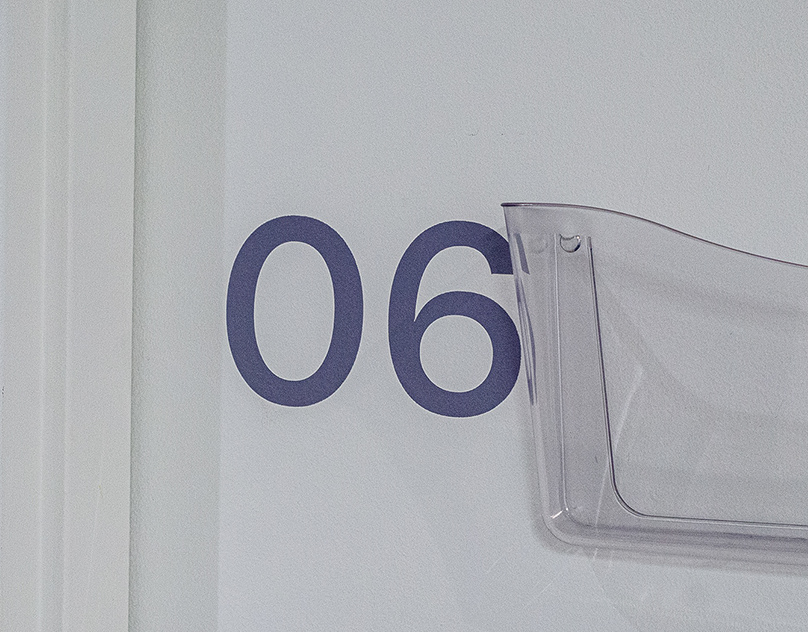
Identify the location of trim. This screenshot has width=808, height=632. (162, 165).